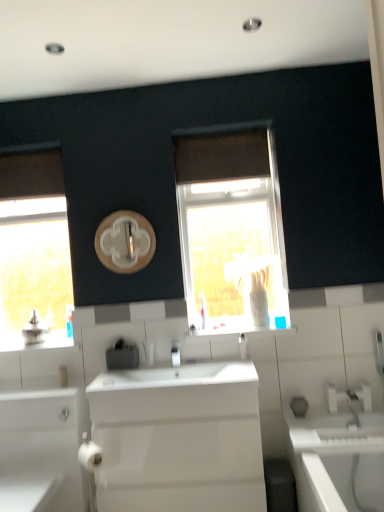
Question: Is translucent glass window at center, the second window positioned from the back, taller or shorter than white glossy bathtub at lower right?

Choices:
 (A) short
 (B) tall

Answer: (B)

Question: Is translucent glass window at center, the 1th window from the front, bigger or smaller than white glossy bathtub at lower right?

Choices:
 (A) small
 (B) big

Answer: (A)

Question: Estimate the real-world distances between objects in this image. Which object is farther from the clear plastic soap dispenser at center?

Choices:
 (A) translucent glass window at center, which is the 2th window in left-to-right order
 (B) translucent plastic tube at center
 (C) black plastic soap dispenser at center, acting as the first appliance starting from the right
 (D) wooden circle at center
 (E) white glossy window sill at center

Answer: (B)

Question: Based on their relative distances, which object is farther from the translucent plastic tube at center?

Choices:
 (A) clear glass window at left, which is counted as the second window, starting from the right
 (B) wooden circle at center
 (C) white glossy sink at center
 (D) satin silver faucet at left, the first appliance when ordered from back to front
 (E) white glossy cabinet at lower left

Answer: (A)